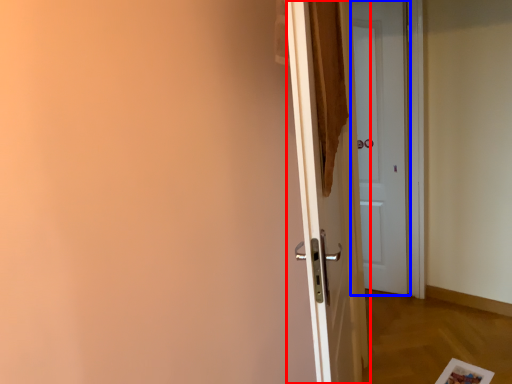
Question: Which object appears farthest to the camera in this image, door (highlighted by a red box) or door (highlighted by a blue box)?

Choices:
 (A) door
 (B) door

Answer: (B)